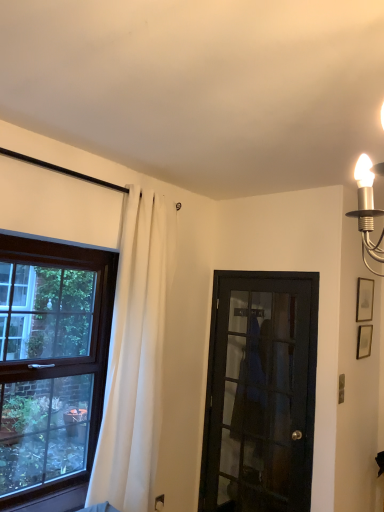
Where is `brown wooden window at left`? brown wooden window at left is located at coordinates (51, 367).

Are white fabric curtain at left and matte silver picture frame at upper right, the first picture frame ordered from the bottom, making contact?

No, white fabric curtain at left is not with matte silver picture frame at upper right, the first picture frame ordered from the bottom.

Considering the relative sizes of white fabric curtain at left and matte silver picture frame at upper right, the second picture frame from the top, in the image provided, is white fabric curtain at left thinner than matte silver picture frame at upper right, the second picture frame from the top,?

No.

Which is nearer, (x=136, y=438) or (x=368, y=352)?

Point (x=136, y=438) is positioned closer to the camera compared to point (x=368, y=352).

How different are the orientations of white fabric curtain at left and matte silver picture frame at upper right, the first picture frame ordered from the bottom, in degrees?

The angle between the facing direction of white fabric curtain at left and the facing direction of matte silver picture frame at upper right, the first picture frame ordered from the bottom, is 2 degrees.

Between matte gold picture frame at upper right, positioned as the 2th picture frame in bottom-to-top order, and brown wooden window at left, which one appears on the right side from the viewer's perspective?

matte gold picture frame at upper right, positioned as the 2th picture frame in bottom-to-top order.

Does matte gold picture frame at upper right, marked as the first picture frame in a top-to-bottom arrangement, lie behind brown wooden window at left?

Yes, matte gold picture frame at upper right, marked as the first picture frame in a top-to-bottom arrangement, is further from the camera.

Where is `picture frame that is the 2nd object located behind the brown wooden window at left`? The image size is (384, 512). picture frame that is the 2nd object located behind the brown wooden window at left is located at coordinates (364, 300).

How far apart are black glass door at center and matte gold picture frame at upper right, positioned as the 2th picture frame in bottom-to-top order?

black glass door at center is 3.44 feet from matte gold picture frame at upper right, positioned as the 2th picture frame in bottom-to-top order.

Are black glass door at center and matte gold picture frame at upper right, positioned as the 2th picture frame in bottom-to-top order, located far from each other?

Indeed, black glass door at center is not near matte gold picture frame at upper right, positioned as the 2th picture frame in bottom-to-top order.

Is the position of black glass door at center more distant than that of matte gold picture frame at upper right, positioned as the 2th picture frame in bottom-to-top order?

That is False.

From a real-world perspective, is matte silver picture frame at upper right, the first picture frame ordered from the bottom, beneath brown wooden window at left?

No, from a real-world perspective, matte silver picture frame at upper right, the first picture frame ordered from the bottom, is not under brown wooden window at left.

Is matte silver picture frame at upper right, the first picture frame ordered from the bottom, shorter than brown wooden window at left?

Yes, matte silver picture frame at upper right, the first picture frame ordered from the bottom, is shorter than brown wooden window at left.

Based on their positions, is matte silver picture frame at upper right, the second picture frame from the top, located to the left or right of brown wooden window at left?

In the image, matte silver picture frame at upper right, the second picture frame from the top, appears on the right side of brown wooden window at left.

How different are the orientations of matte silver picture frame at upper right, the second picture frame from the top, and brown wooden window at left in degrees?

The angle between the facing direction of matte silver picture frame at upper right, the second picture frame from the top, and the facing direction of brown wooden window at left is 1.92 degrees.

Consider the image. Between matte silver picture frame at upper right, the first picture frame ordered from the bottom, and white fabric curtain at left, which one has smaller size?

With smaller size is matte silver picture frame at upper right, the first picture frame ordered from the bottom.

Locate an element on the screen. picture frame that is the 1st one when counting upward from the white fabric curtain at left (from the image's perspective) is located at coordinates (364, 341).

Considering the positions of points (362, 340) and (96, 502), is point (362, 340) farther from camera compared to point (96, 502)?

That is True.

From the image's perspective, is matte silver picture frame at upper right, the second picture frame from the top, above or below white fabric curtain at left?

matte silver picture frame at upper right, the second picture frame from the top, is situated higher than white fabric curtain at left in the image.

Is matte silver picture frame at upper right, the second picture frame from the top, spatially inside matte gold picture frame at upper right, positioned as the 2th picture frame in bottom-to-top order, or outside of it?

matte silver picture frame at upper right, the second picture frame from the top, exists outside the volume of matte gold picture frame at upper right, positioned as the 2th picture frame in bottom-to-top order.

In order to click on picture frame located above the matte silver picture frame at upper right, the first picture frame ordered from the bottom (from the image's perspective) in this screenshot , I will do `click(364, 300)`.

Are matte silver picture frame at upper right, the first picture frame ordered from the bottom, and matte gold picture frame at upper right, positioned as the 2th picture frame in bottom-to-top order, making contact?

No, matte silver picture frame at upper right, the first picture frame ordered from the bottom, is not with matte gold picture frame at upper right, positioned as the 2th picture frame in bottom-to-top order.

Considering the relative sizes of matte silver picture frame at upper right, the second picture frame from the top, and matte gold picture frame at upper right, marked as the first picture frame in a top-to-bottom arrangement, in the image provided, is matte silver picture frame at upper right, the second picture frame from the top, taller than matte gold picture frame at upper right, marked as the first picture frame in a top-to-bottom arrangement,?

Incorrect, the height of matte silver picture frame at upper right, the second picture frame from the top, is not larger of that of matte gold picture frame at upper right, marked as the first picture frame in a top-to-bottom arrangement.

From the image's perspective, is matte gold picture frame at upper right, marked as the first picture frame in a top-to-bottom arrangement, below black glass door at center?

Incorrect, from the image's perspective, matte gold picture frame at upper right, marked as the first picture frame in a top-to-bottom arrangement, is higher than black glass door at center.

From a real-world perspective, is matte gold picture frame at upper right, positioned as the 2th picture frame in bottom-to-top order, on top of black glass door at center?

Yes, from a real-world perspective, matte gold picture frame at upper right, positioned as the 2th picture frame in bottom-to-top order, is on top of black glass door at center.

Is point (365, 287) positioned in front of point (280, 455)?

No, (365, 287) is behind (280, 455).

Is matte gold picture frame at upper right, positioned as the 2th picture frame in bottom-to-top order, looking in the opposite direction of black glass door at center?

That's not correct — matte gold picture frame at upper right, positioned as the 2th picture frame in bottom-to-top order, is not looking away from black glass door at center.

Locate an element on the screen. Image resolution: width=384 pixels, height=512 pixels. the 1st picture frame to the right when counting from the white fabric curtain at left is located at coordinates (364, 341).

Locate an element on the screen. This screenshot has height=512, width=384. the 2nd picture frame positioned above the brown wooden window at left (from the image's perspective) is located at coordinates (364, 300).

Based on their spatial positions, is brown wooden window at left or matte gold picture frame at upper right, positioned as the 2th picture frame in bottom-to-top order, closer to white fabric curtain at left?

brown wooden window at left.

Based on their spatial positions, is black glass door at center or brown wooden window at left closer to matte gold picture frame at upper right, marked as the first picture frame in a top-to-bottom arrangement?

Based on the image, black glass door at center appears to be nearer to matte gold picture frame at upper right, marked as the first picture frame in a top-to-bottom arrangement.

Estimate the real-world distances between objects in this image. Which object is further from brown wooden window at left, matte silver picture frame at upper right, the first picture frame ordered from the bottom, or matte gold picture frame at upper right, marked as the first picture frame in a top-to-bottom arrangement?

matte silver picture frame at upper right, the first picture frame ordered from the bottom, is further to brown wooden window at left.

When comparing their distances from matte silver picture frame at upper right, the first picture frame ordered from the bottom, does matte gold picture frame at upper right, marked as the first picture frame in a top-to-bottom arrangement, or black glass door at center seem closer?

Among the two, matte gold picture frame at upper right, marked as the first picture frame in a top-to-bottom arrangement, is located nearer to matte silver picture frame at upper right, the first picture frame ordered from the bottom.

Estimate the real-world distances between objects in this image. Which object is further from white fabric curtain at left, matte gold picture frame at upper right, marked as the first picture frame in a top-to-bottom arrangement, or matte silver picture frame at upper right, the second picture frame from the top?

matte silver picture frame at upper right, the second picture frame from the top.

Considering their positions, is white fabric curtain at left positioned closer to brown wooden window at left than matte gold picture frame at upper right, marked as the first picture frame in a top-to-bottom arrangement?

white fabric curtain at left is closer to brown wooden window at left.

Based on their spatial positions, is black glass door at center or matte gold picture frame at upper right, positioned as the 2th picture frame in bottom-to-top order, closer to white fabric curtain at left?

Among the two, black glass door at center is located nearer to white fabric curtain at left.

Estimate the real-world distances between objects in this image. Which object is closer to matte silver picture frame at upper right, the first picture frame ordered from the bottom, matte gold picture frame at upper right, marked as the first picture frame in a top-to-bottom arrangement, or white fabric curtain at left?

matte gold picture frame at upper right, marked as the first picture frame in a top-to-bottom arrangement.

In order to click on door between white fabric curtain at left and matte gold picture frame at upper right, positioned as the 2th picture frame in bottom-to-top order in this screenshot , I will do `click(260, 393)`.

The height and width of the screenshot is (512, 384). What are the coordinates of `curtain between brown wooden window at left and black glass door at center from left to right` in the screenshot? It's located at (135, 357).

This screenshot has width=384, height=512. In order to click on picture frame situated between brown wooden window at left and matte gold picture frame at upper right, marked as the first picture frame in a top-to-bottom arrangement, from left to right in this screenshot , I will do [x=364, y=341].

Identify the location of curtain between brown wooden window at left and matte silver picture frame at upper right, the second picture frame from the top, in the horizontal direction. The width and height of the screenshot is (384, 512). (135, 357).